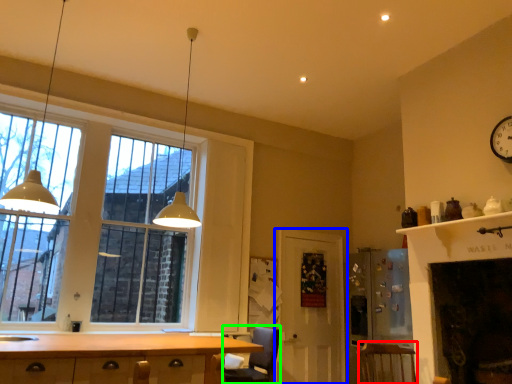
Question: Which object is the farthest from armchair (highlighted by a red box)? Choose among these: door (highlighted by a blue box) or armchair (highlighted by a green box).

Choices:
 (A) door
 (B) armchair

Answer: (A)